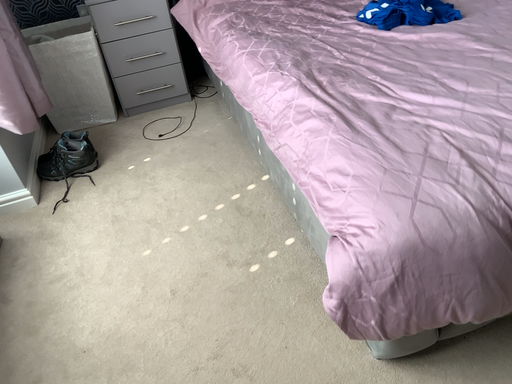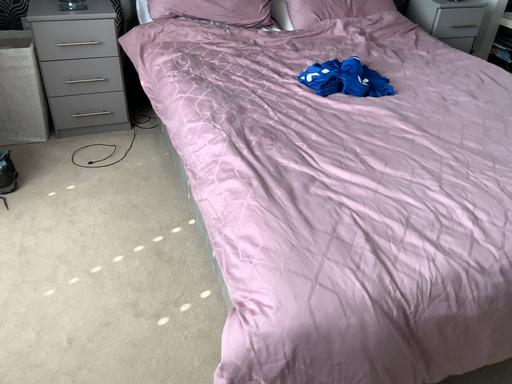
Question: Which way did the camera rotate in the video?

Choices:
 (A) rotated left
 (B) rotated right

Answer: (B)